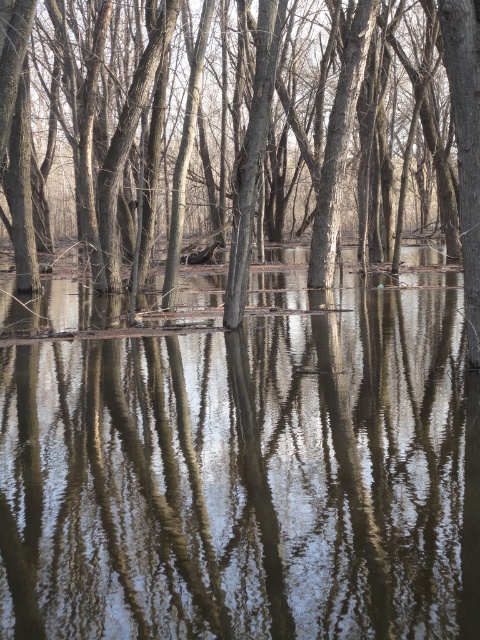
Question: Which point is closer to the camera taking this photo?

Choices:
 (A) (355, 65)
 (B) (160, 344)

Answer: (B)

Question: Which point appears closest to the camera in this image?

Choices:
 (A) (433, 394)
 (B) (248, 125)

Answer: (A)

Question: Observing the image, what is the correct spatial positioning of clear water at center in reference to smooth bark tree at center?

Choices:
 (A) left
 (B) right

Answer: (B)

Question: Which object appears closest to the camera in this image?

Choices:
 (A) clear water at center
 (B) smooth bark tree at center

Answer: (A)

Question: Is clear water at center positioned in front of smooth bark tree at center?

Choices:
 (A) yes
 (B) no

Answer: (A)

Question: Can you confirm if clear water at center is wider than smooth bark tree at center?

Choices:
 (A) no
 (B) yes

Answer: (A)